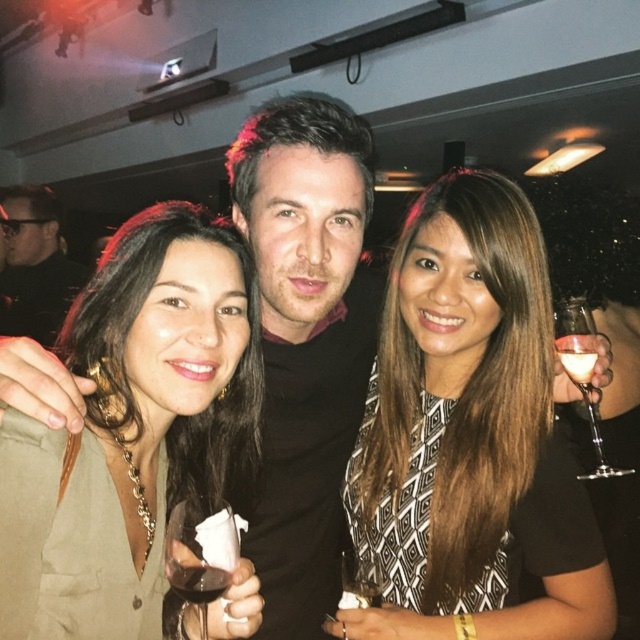
Who is more forward, (x=472, y=307) or (x=218, y=593)?

Point (x=218, y=593)

Between black and white dress at center and translucent glass wine at center, which one appears on the left side from the viewer's perspective?

From the viewer's perspective, translucent glass wine at center appears more on the left side.

What do you see at coordinates (468, 435) in the screenshot?
I see `black and white dress at center` at bounding box center [468, 435].

At what (x,y) coordinates should I click in order to perform the action: click on black and white dress at center. Please return your answer as a coordinate pair (x, y). Looking at the image, I should click on (468, 435).

Which is more to the right, black and white dress at center or matte olive green dress at center?

black and white dress at center

Can you confirm if black and white dress at center is positioned above matte olive green dress at center?

Yes, black and white dress at center is above matte olive green dress at center.

Does point (582, 600) come in front of point (248, 384)?

Yes, point (582, 600) is in front of point (248, 384).

You are a GUI agent. You are given a task and a screenshot of the screen. Output one action in this format:
    pyautogui.click(x=<x>, y=<y>)
    Task: Click on the black and white dress at center
    
    Given the screenshot: What is the action you would take?
    pyautogui.click(x=468, y=435)

Can you confirm if clear glass wine glass at right is wider than translucent glass wine at center?

Correct, the width of clear glass wine glass at right exceeds that of translucent glass wine at center.

Does clear glass wine glass at right have a greater height compared to translucent glass wine at center?

Correct, clear glass wine glass at right is much taller as translucent glass wine at center.

Describe the element at coordinates (582, 371) in the screenshot. This screenshot has height=640, width=640. I see `clear glass wine glass at right` at that location.

You are a GUI agent. You are given a task and a screenshot of the screen. Output one action in this format:
    pyautogui.click(x=<x>, y=<y>)
    Task: Click on the clear glass wine glass at right
    This screenshot has width=640, height=640.
    Given the screenshot: What is the action you would take?
    pyautogui.click(x=582, y=371)